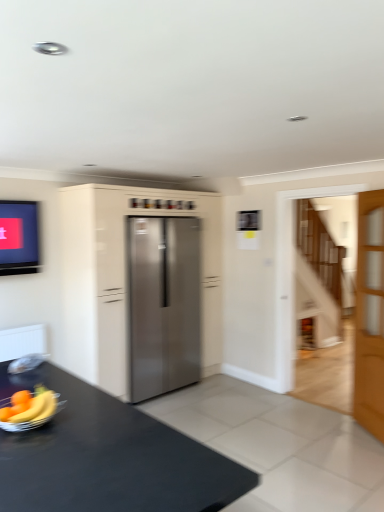
Identify the location of vacant area on top of black matte table at lower left (from a real-world perspective). This screenshot has width=384, height=512. (90, 445).